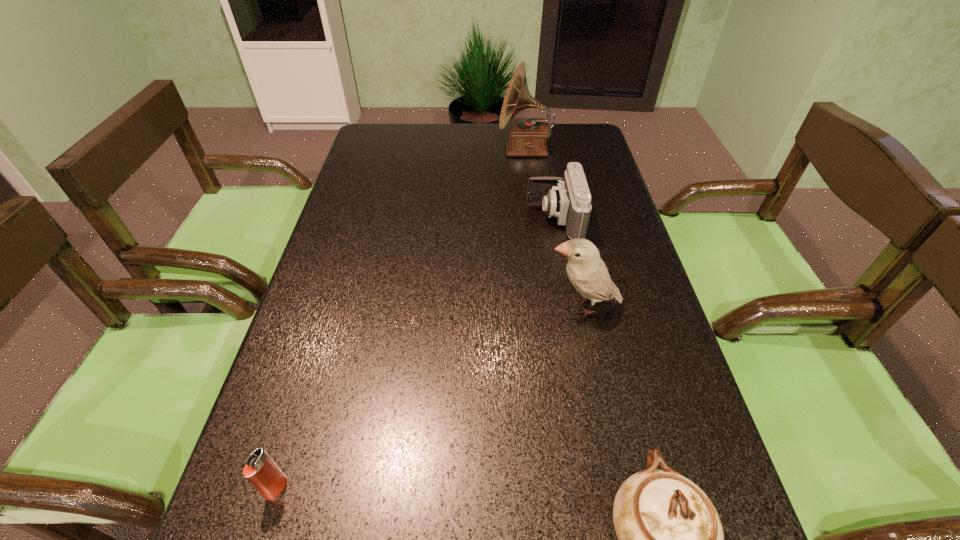
The height and width of the screenshot is (540, 960). In order to click on the tallest object in this screenshot , I will do `click(527, 136)`.

The image size is (960, 540). I want to click on phonograph record, so click(527, 136).

Identify the location of bird. (587, 272).

Identify the location of the fourth shortest object. This screenshot has width=960, height=540. pos(587,272).

This screenshot has width=960, height=540. I want to click on the second farthest object, so click(x=569, y=199).

This screenshot has height=540, width=960. I want to click on the leftmost object, so click(261, 471).

Identify the location of vacant space located on the horn of the tallest object. The image size is (960, 540). (428, 148).

Where is `vacant region located 0.120m on the horn of the tallest object`? vacant region located 0.120m on the horn of the tallest object is located at coordinates (462, 148).

At what (x,y) coordinates should I click in order to perform the action: click on blank space located on the horn of the tallest object. Please return your answer as a coordinate pair (x, y). Looking at the image, I should click on (404, 148).

Where is `free location located 0.090m at the face of the second tallest object`? Image resolution: width=960 pixels, height=540 pixels. free location located 0.090m at the face of the second tallest object is located at coordinates (505, 306).